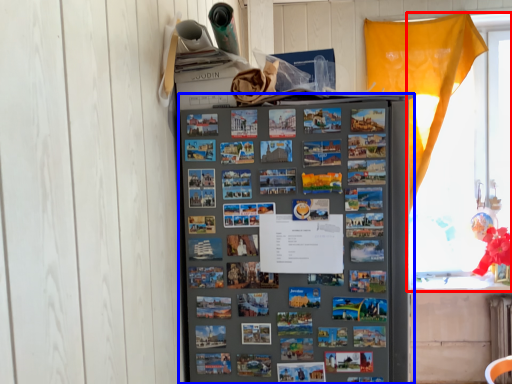
Question: Among these objects, which one is farthest to the camera, window (highlighted by a red box) or refrigerator (highlighted by a blue box)?

Choices:
 (A) window
 (B) refrigerator

Answer: (A)